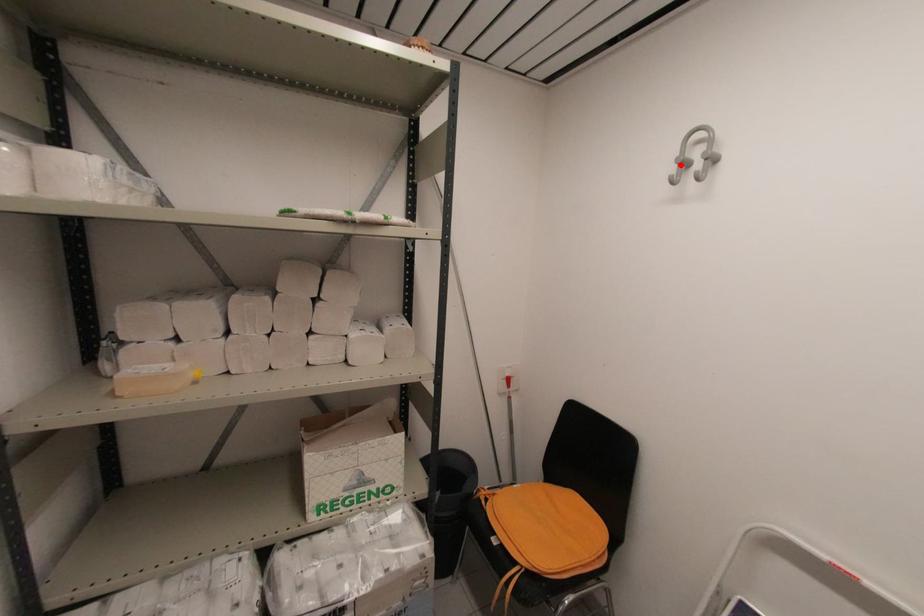
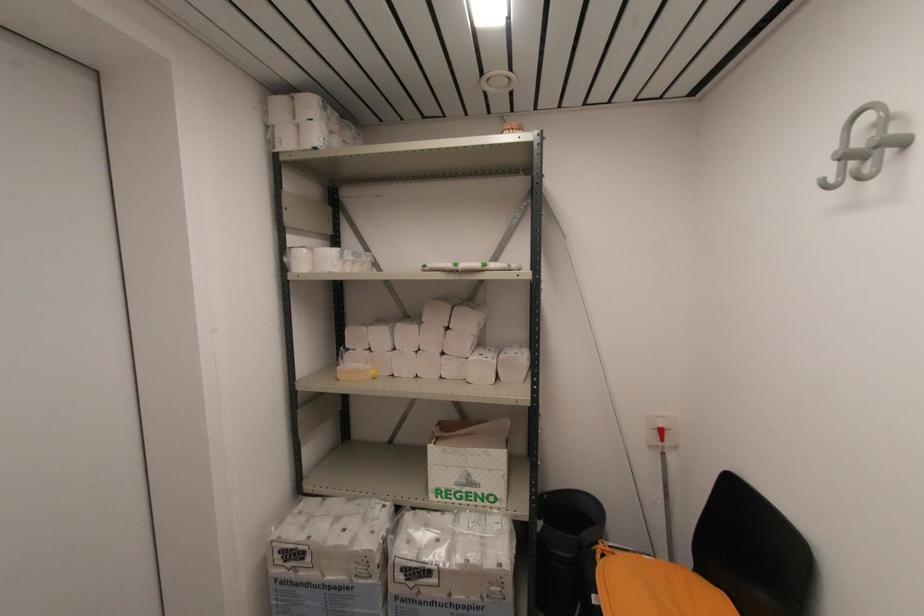
Find the pixel in the second image that matches the highlighted location in the first image.

(843, 160)